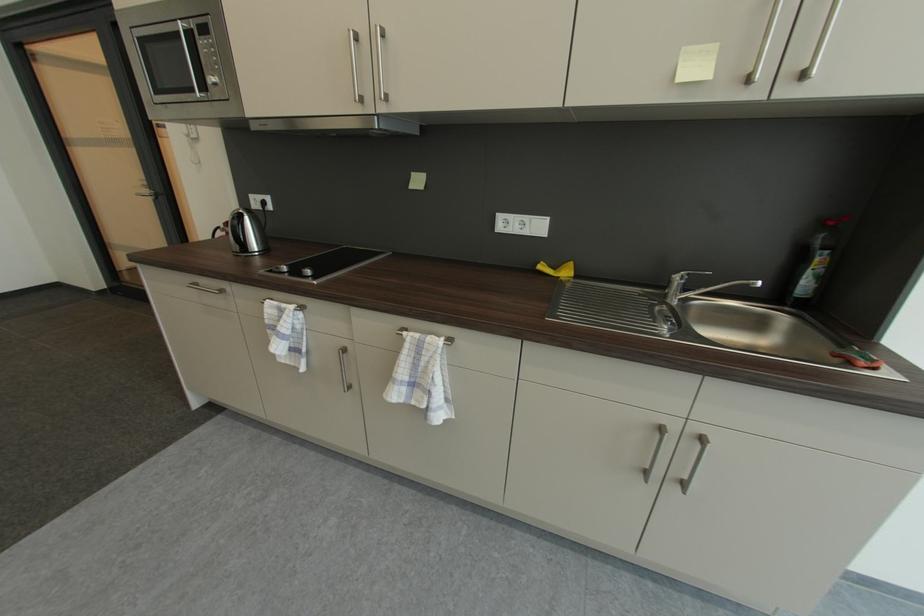
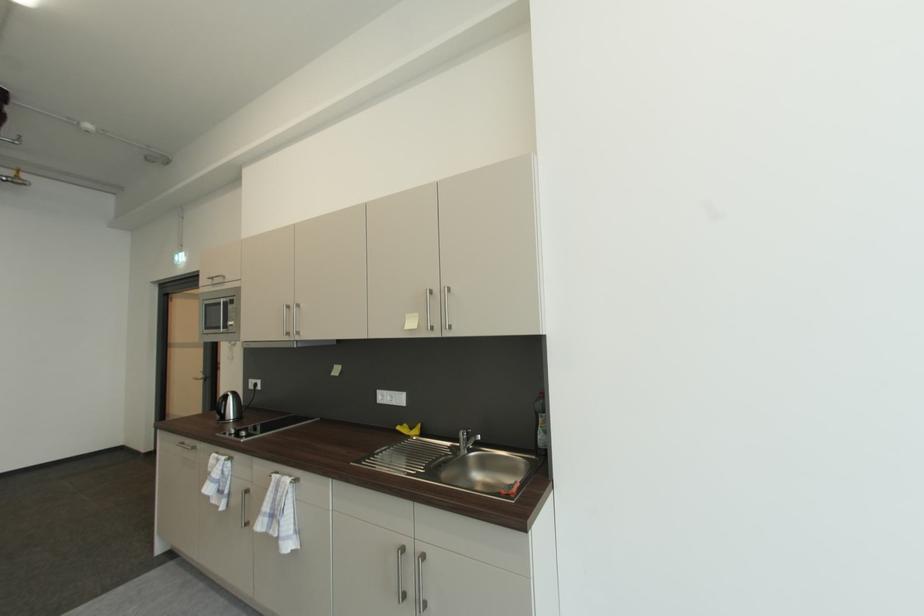
In a continuous first-person perspective shot, in which direction is the camera moving?

The movement direction of the cameraman is right, backward.